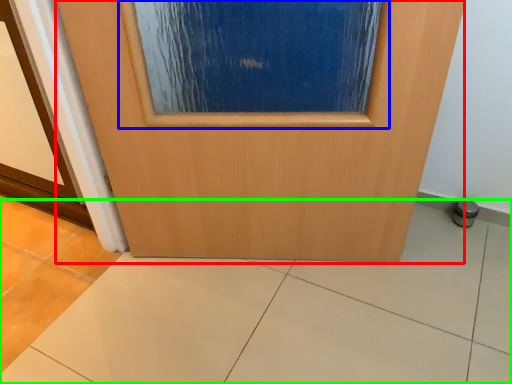
Question: Which object is the farthest from door (highlighted by a red box)? Choose among these: airplane window (highlighted by a blue box) or ceramic tile (highlighted by a green box).

Choices:
 (A) airplane window
 (B) ceramic tile

Answer: (B)